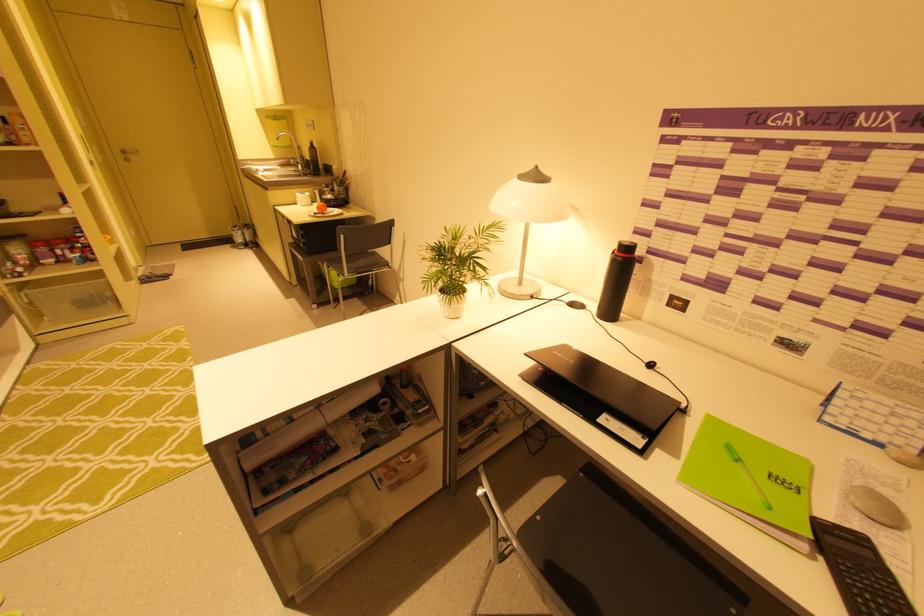
What are the coordinates of `metal door handle` in the screenshot? It's located at (128, 153).